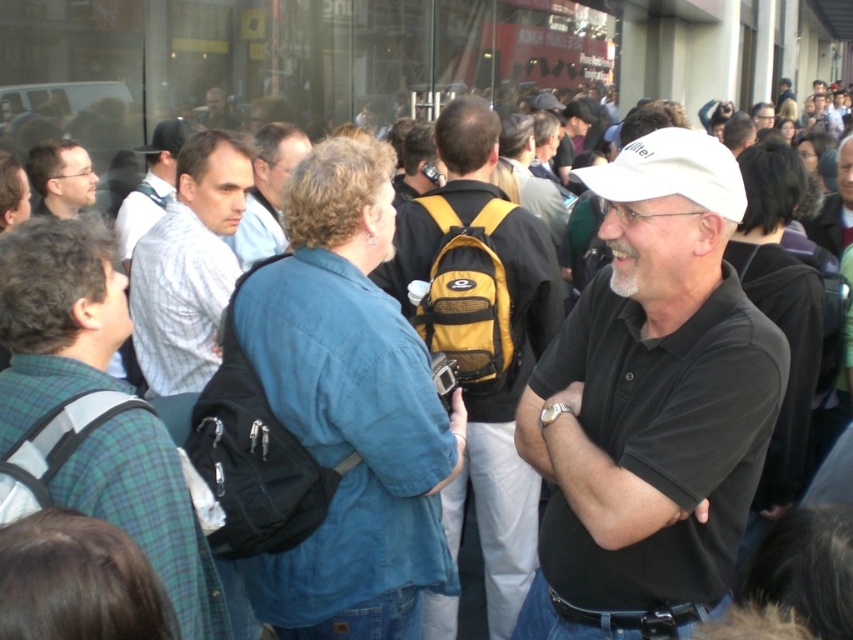
You are a photographer trying to capture a clear shot of the white matte cap at center and the matte black glasses at upper left. Based on their positions and sizes in the image, which object would require you to zoom in more to fill the frame?

The matte black glasses at upper left would require more zooming in because they are smaller than the white matte cap at center.

You are a photographer trying to capture a candid shot of the light blue shirt at center and the matte black glasses at upper left. Which object will require a wider angle lens to ensure it fits entirely in the frame?

The light blue shirt at center requires a wider angle lens because its width is larger than the matte black glasses at upper left.

You are standing at the origin point in the image and want to locate the light blue shirt at center. Which direction should you look to find it?

The light blue shirt at center is located at point 0.302 on the x axis and 0.314 on the y axis, so you should look slightly to the right and slightly upwards from the origin point.